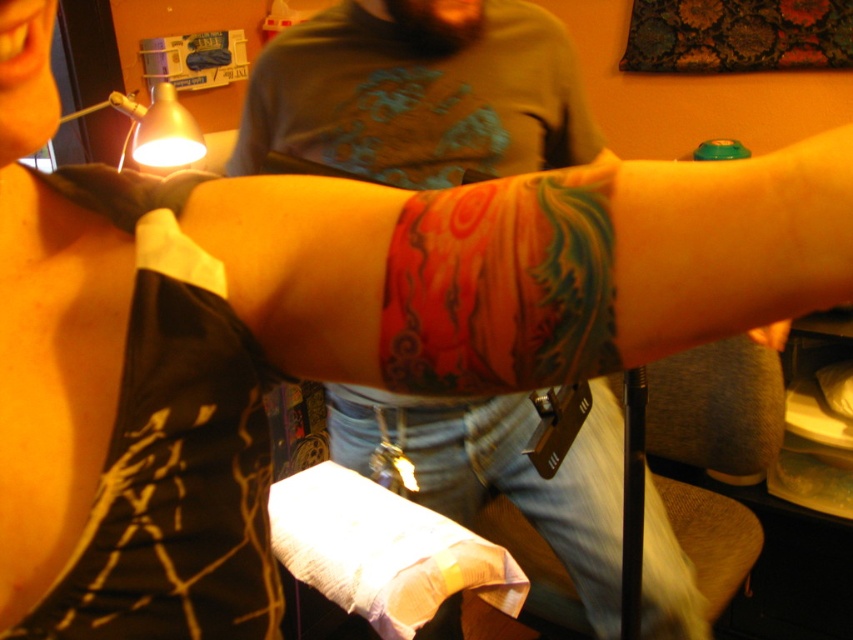
Question: Does multicolored tattoo at center appear under vivid ink tattoo at center?

Choices:
 (A) yes
 (B) no

Answer: (B)

Question: Is vivid ink tattoo at center further to the viewer compared to smooth orange skin at lower right?

Choices:
 (A) yes
 (B) no

Answer: (B)

Question: Does multicolored tattoo at center appear under smooth orange skin at lower right?

Choices:
 (A) yes
 (B) no

Answer: (B)

Question: Estimate the real-world distances between objects in this image. Which object is closer to the vivid ink tattoo at center?

Choices:
 (A) multicolored tattoo at center
 (B) smooth orange skin at lower right

Answer: (A)

Question: Which object is closer to the camera taking this photo?

Choices:
 (A) multicolored tattoo at center
 (B) vivid ink tattoo at center

Answer: (A)

Question: Among these objects, which one is nearest to the camera?

Choices:
 (A) vivid ink tattoo at center
 (B) multicolored tattoo at center

Answer: (B)